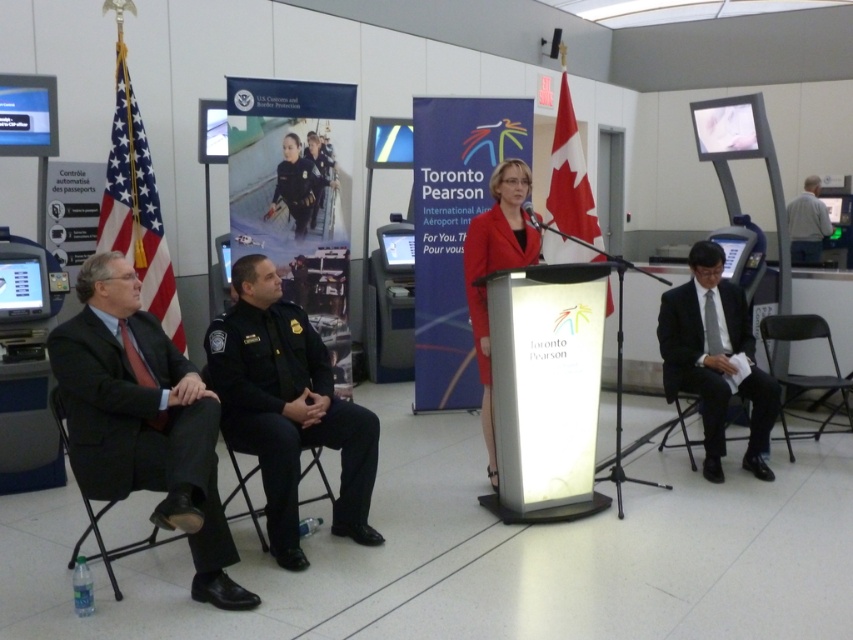
Question: Can you confirm if black plastic chair at lower right is positioned above black fabric chair at left?

Choices:
 (A) no
 (B) yes

Answer: (B)

Question: Which point is closer to the camera taking this photo?

Choices:
 (A) (202, 372)
 (B) (144, 332)
 (C) (727, 396)
 (D) (357, 456)

Answer: (B)

Question: Which point is closer to the camera?

Choices:
 (A) black fabric chair at center
 (B) matte red coat at center

Answer: (A)

Question: Which point appears farthest from the camera in this image?

Choices:
 (A) (167, 468)
 (B) (781, 326)
 (C) (482, 316)
 (D) (238, 346)

Answer: (B)

Question: Is dark suit at left wider than black plastic chair at lower right?

Choices:
 (A) yes
 (B) no

Answer: (B)

Question: Is dark suit at left behind black fabric chair at center?

Choices:
 (A) yes
 (B) no

Answer: (B)